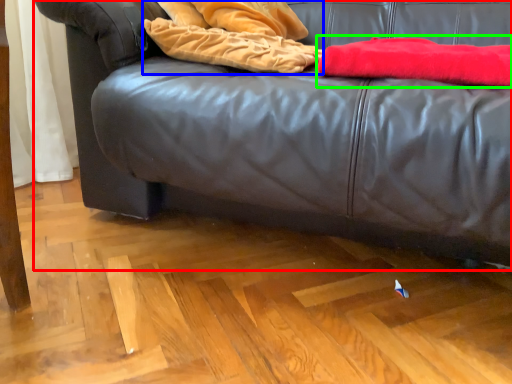
Question: Which object is the farthest from studio couch (highlighted by a red box)? Choose among these: blanket (highlighted by a blue box) or blanket (highlighted by a green box).

Choices:
 (A) blanket
 (B) blanket

Answer: (B)